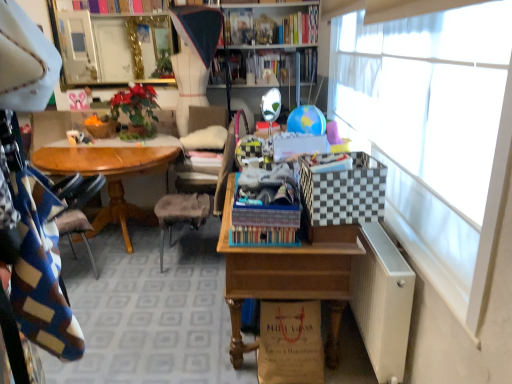
Question: Is white metallic radiator at lower right closer to the viewer compared to burlap flowerpot at center?

Choices:
 (A) yes
 (B) no

Answer: (A)

Question: Is white metallic radiator at lower right surrounding burlap flowerpot at center?

Choices:
 (A) yes
 (B) no

Answer: (B)

Question: Considering the relative sizes of white metallic radiator at lower right and burlap flowerpot at center in the image provided, is white metallic radiator at lower right wider than burlap flowerpot at center?

Choices:
 (A) yes
 (B) no

Answer: (B)

Question: From a real-world perspective, is white metallic radiator at lower right on top of burlap flowerpot at center?

Choices:
 (A) yes
 (B) no

Answer: (B)

Question: Would you say white metallic radiator at lower right is outside burlap flowerpot at center?

Choices:
 (A) yes
 (B) no

Answer: (A)

Question: Is white metallic radiator at lower right not near burlap flowerpot at center?

Choices:
 (A) no
 (B) yes

Answer: (B)

Question: Is white metallic radiator at lower right at the right side of hardcover book at upper center, arranged as the second book when viewed from the right?

Choices:
 (A) yes
 (B) no

Answer: (A)

Question: Considering the relative sizes of white metallic radiator at lower right and hardcover book at upper center, the first book in the left-to-right sequence, in the image provided, is white metallic radiator at lower right shorter than hardcover book at upper center, the first book in the left-to-right sequence,?

Choices:
 (A) yes
 (B) no

Answer: (B)

Question: Does white metallic radiator at lower right contain hardcover book at upper center, arranged as the second book when viewed from the right?

Choices:
 (A) no
 (B) yes

Answer: (A)

Question: Does white metallic radiator at lower right turn towards hardcover book at upper center, arranged as the second book when viewed from the top?

Choices:
 (A) no
 (B) yes

Answer: (A)

Question: Is white metallic radiator at lower right smaller than hardcover book at upper center, which ranks as the first book in bottom-to-top order?

Choices:
 (A) no
 (B) yes

Answer: (A)

Question: Are white metallic radiator at lower right and hardcover book at upper center, the first book in the left-to-right sequence, located far from each other?

Choices:
 (A) no
 (B) yes

Answer: (B)

Question: Considering the relative sizes of wooden desk at center and white metallic radiator at lower right in the image provided, is wooden desk at center taller than white metallic radiator at lower right?

Choices:
 (A) yes
 (B) no

Answer: (A)